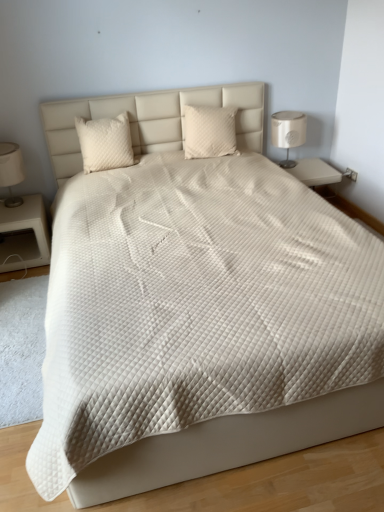
The height and width of the screenshot is (512, 384). Describe the element at coordinates (209, 131) in the screenshot. I see `quilted beige pillow at center, arranged as the 2th pillow when viewed from the left` at that location.

Find the location of `white soft carpet at lower left`. white soft carpet at lower left is located at coordinates (22, 349).

I want to click on white quilted pillow at upper left, the first pillow in the left-to-right sequence, so click(105, 143).

The image size is (384, 512). Identify the location of quilted beige pillow at center, positioned as the 1th pillow in right-to-left order. (209, 131).

Which object is positioned more to the left, white matte nightstand at left or quilted beige pillow at center, positioned as the 1th pillow in right-to-left order?

white matte nightstand at left.

Is white matte nightstand at left far from quilted beige pillow at center, positioned as the 1th pillow in right-to-left order?

Yes.

In the scene shown: Which object is closer to the camera, white matte nightstand at left or quilted beige pillow at center, positioned as the 1th pillow in right-to-left order?

white matte nightstand at left is more forward.

From the image's perspective, is white matte nightstand at left positioned above or below quilted beige pillow at center, arranged as the 2th pillow when viewed from the left?

white matte nightstand at left is situated lower than quilted beige pillow at center, arranged as the 2th pillow when viewed from the left, in the image.

Which is more distant, (x=16, y=198) or (x=0, y=417)?

The point (x=16, y=198) is more distant.

Is matte white lampshade at left, positioned as the 2th bedside lamp in right-to-left order, touching white soft carpet at lower left?

No.

Considering the relative sizes of matte white lampshade at left, positioned as the 2th bedside lamp in right-to-left order, and white soft carpet at lower left in the image provided, is matte white lampshade at left, positioned as the 2th bedside lamp in right-to-left order, bigger than white soft carpet at lower left?

Yes, matte white lampshade at left, positioned as the 2th bedside lamp in right-to-left order, is bigger than white soft carpet at lower left.

Is matte white lampshade at left, positioned as the 2th bedside lamp in right-to-left order, positioned beyond the bounds of white soft carpet at lower left?

Yes, matte white lampshade at left, positioned as the 2th bedside lamp in right-to-left order, is not within white soft carpet at lower left.

Is white soft carpet at lower left next to white matte nightstand at left and touching it?

No.

Does white soft carpet at lower left appear on the right side of white matte nightstand at left?

Yes, white soft carpet at lower left is to the right of white matte nightstand at left.

How many degrees apart are the facing directions of white soft carpet at lower left and white matte nightstand at left?

There is a 2.08-degree angle between the facing directions of white soft carpet at lower left and white matte nightstand at left.

From their relative heights in the image, would you say matte white lampshade at left, which appears as the first bedside lamp when viewed from the left, is taller or shorter than white fabric lampshade at right, the 2th bedside lamp when ordered from left to right?

matte white lampshade at left, which appears as the first bedside lamp when viewed from the left, is shorter than white fabric lampshade at right, the 2th bedside lamp when ordered from left to right.

Which of these two, matte white lampshade at left, positioned as the 2th bedside lamp in right-to-left order, or white fabric lampshade at right, the 2th bedside lamp when ordered from left to right, is bigger?

white fabric lampshade at right, the 2th bedside lamp when ordered from left to right, is bigger.

Looking at their sizes, would you say matte white lampshade at left, which appears as the first bedside lamp when viewed from the left, is wider or thinner than white fabric lampshade at right, the 2th bedside lamp when ordered from left to right?

matte white lampshade at left, which appears as the first bedside lamp when viewed from the left, is thinner than white fabric lampshade at right, the 2th bedside lamp when ordered from left to right.

From a real-world perspective, between quilted beige pillow at center, arranged as the 2th pillow when viewed from the left, and white quilted pillow at upper left, the 2th pillow when ordered from right to left, who is vertically lower?

white quilted pillow at upper left, the 2th pillow when ordered from right to left.

Which is more to the right, quilted beige pillow at center, arranged as the 2th pillow when viewed from the left, or white quilted pillow at upper left, the 2th pillow when ordered from right to left?

quilted beige pillow at center, arranged as the 2th pillow when viewed from the left.

Would you say quilted beige pillow at center, arranged as the 2th pillow when viewed from the left, contains white quilted pillow at upper left, the 2th pillow when ordered from right to left?

Actually, white quilted pillow at upper left, the 2th pillow when ordered from right to left, is outside quilted beige pillow at center, arranged as the 2th pillow when viewed from the left.

From the image's perspective, does white fabric lampshade at right, the 2th bedside lamp when ordered from left to right, appear lower than white quilted pillow at upper left, the 2th pillow when ordered from right to left?

No, from the image's perspective, white fabric lampshade at right, the 2th bedside lamp when ordered from left to right, is not below white quilted pillow at upper left, the 2th pillow when ordered from right to left.

From a real-world perspective, which pillow is the 1st one above the white fabric lampshade at right, the 2th bedside lamp when ordered from left to right? Please provide its 2D coordinates.

[(105, 143)]

Which is nearer, [305,118] or [128,129]?

Point [305,118] is farther from the camera than point [128,129].

How much distance is there between white matte nightstand at left and white soft carpet at lower left?

18.93 inches.

Identify the location of nightstand above the white soft carpet at lower left (from the image's perspective). Image resolution: width=384 pixels, height=512 pixels. (24, 234).

Is white soft carpet at lower left completely or partially inside white matte nightstand at left?

Definitely not — white soft carpet at lower left is not inside white matte nightstand at left.

Which of these two, white matte nightstand at left or white soft carpet at lower left, stands taller?

Standing taller between the two is white matte nightstand at left.

The height and width of the screenshot is (512, 384). I want to click on pillow behind the white matte nightstand at left, so click(209, 131).

From the image's perspective, count 1st bedside lamps upward from the white soft carpet at lower left and point to it. Please provide its 2D coordinates.

[(11, 170)]

Estimate the real-world distances between objects in this image. Which object is further from white quilted pillow at upper left, the first pillow in the left-to-right sequence, quilted beige pillow at center, arranged as the 2th pillow when viewed from the left, or white soft carpet at lower left?

white soft carpet at lower left lies further to white quilted pillow at upper left, the first pillow in the left-to-right sequence, than the other object.

Looking at the image, which one is located closer to white quilted pillow at upper left, the first pillow in the left-to-right sequence, quilted beige pillow at center, arranged as the 2th pillow when viewed from the left, or white fabric lampshade at right, the 2th bedside lamp when ordered from left to right?

The object closer to white quilted pillow at upper left, the first pillow in the left-to-right sequence, is quilted beige pillow at center, arranged as the 2th pillow when viewed from the left.

Looking at the image, which one is located further to white fabric lampshade at right, marked as the 1th bedside lamp in a right-to-left arrangement, matte white lampshade at left, which appears as the first bedside lamp when viewed from the left, or white quilted pillow at upper left, the first pillow in the left-to-right sequence?

matte white lampshade at left, which appears as the first bedside lamp when viewed from the left, is positioned further to the anchor white fabric lampshade at right, marked as the 1th bedside lamp in a right-to-left arrangement.

When comparing their distances from matte white lampshade at left, positioned as the 2th bedside lamp in right-to-left order, does quilted beige pillow at center, positioned as the 1th pillow in right-to-left order, or white quilted pillow at upper left, the 2th pillow when ordered from right to left, seem further?

quilted beige pillow at center, positioned as the 1th pillow in right-to-left order.

Based on the photo, when comparing their distances from white matte nightstand at left, does quilted beige pillow at center, arranged as the 2th pillow when viewed from the left, or white quilted pillow at upper left, the 2th pillow when ordered from right to left, seem closer?

Among the two, white quilted pillow at upper left, the 2th pillow when ordered from right to left, is located nearer to white matte nightstand at left.

From the image, which object appears to be farther from white matte nightstand at left, quilted beige pillow at center, positioned as the 1th pillow in right-to-left order, or white soft carpet at lower left?

Among the two, quilted beige pillow at center, positioned as the 1th pillow in right-to-left order, is located further to white matte nightstand at left.

Based on their spatial positions, is white soft carpet at lower left or white matte nightstand at left further from matte white lampshade at left, which appears as the first bedside lamp when viewed from the left?

white soft carpet at lower left lies further to matte white lampshade at left, which appears as the first bedside lamp when viewed from the left, than the other object.

Based on their spatial positions, is white quilted pillow at upper left, the first pillow in the left-to-right sequence, or matte white lampshade at left, positioned as the 2th bedside lamp in right-to-left order, closer to white matte nightstand at left?

Among the two, matte white lampshade at left, positioned as the 2th bedside lamp in right-to-left order, is located nearer to white matte nightstand at left.

At what (x,y) coordinates should I click in order to perform the action: click on nightstand between matte white lampshade at left, positioned as the 2th bedside lamp in right-to-left order, and white fabric lampshade at right, marked as the 1th bedside lamp in a right-to-left arrangement. Please return your answer as a coordinate pair (x, y). The height and width of the screenshot is (512, 384). Looking at the image, I should click on (24, 234).

Where is `nightstand that lies between white quilted pillow at upper left, the 2th pillow when ordered from right to left, and white soft carpet at lower left from top to bottom`? The height and width of the screenshot is (512, 384). nightstand that lies between white quilted pillow at upper left, the 2th pillow when ordered from right to left, and white soft carpet at lower left from top to bottom is located at coordinates (24, 234).

Where is `mat situated between matte white lampshade at left, positioned as the 2th bedside lamp in right-to-left order, and white fabric lampshade at right, the 2th bedside lamp when ordered from left to right, from left to right`? mat situated between matte white lampshade at left, positioned as the 2th bedside lamp in right-to-left order, and white fabric lampshade at right, the 2th bedside lamp when ordered from left to right, from left to right is located at coordinates (22, 349).

What are the coordinates of `bedside lamp between white quilted pillow at upper left, the first pillow in the left-to-right sequence, and white soft carpet at lower left vertically` in the screenshot? It's located at (11, 170).